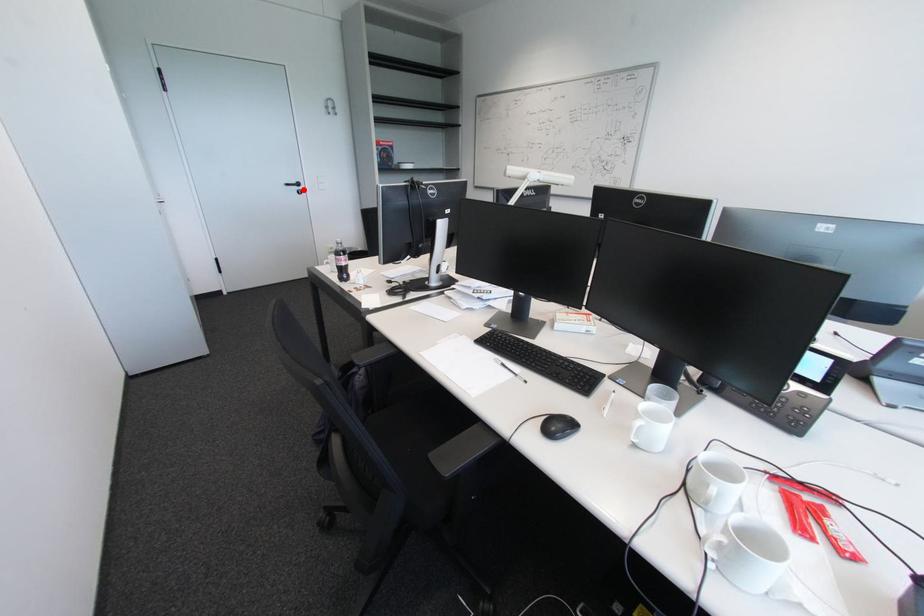
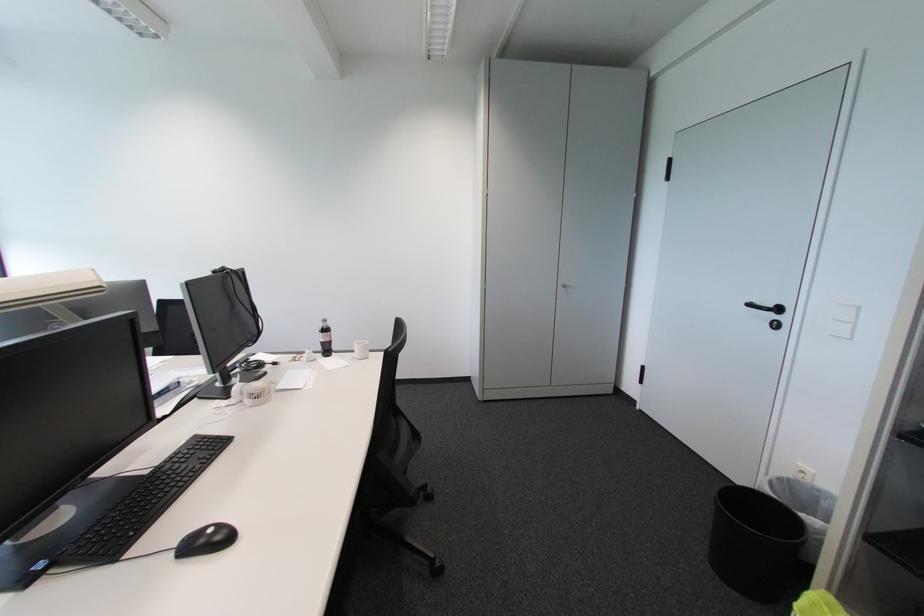
Find the pixel in the second image that matches the highlighted location in the first image.

(777, 317)